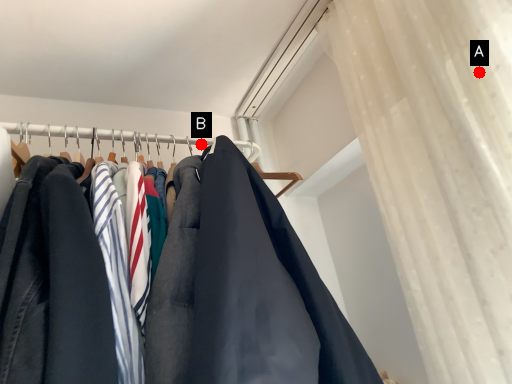
Question: Two points are circled on the image, labeled by A and B beside each circle. Which point is closer to the camera taking this photo?

Choices:
 (A) A is closer
 (B) B is closer

Answer: (A)